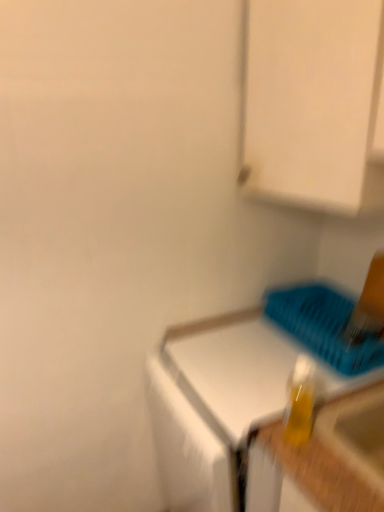
This screenshot has width=384, height=512. Find the location of `vacant space to the left of blue plastic basket at lower right`. vacant space to the left of blue plastic basket at lower right is located at coordinates (243, 347).